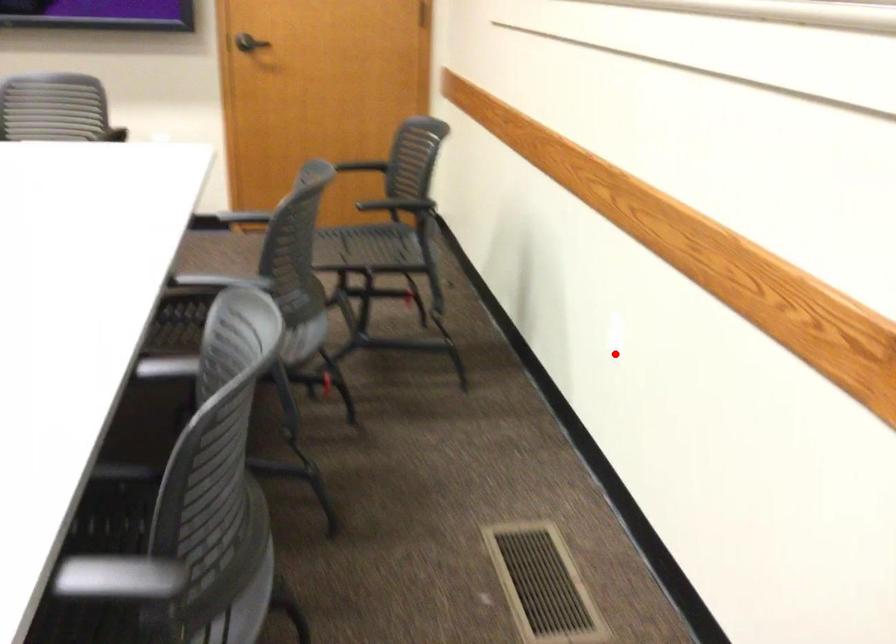
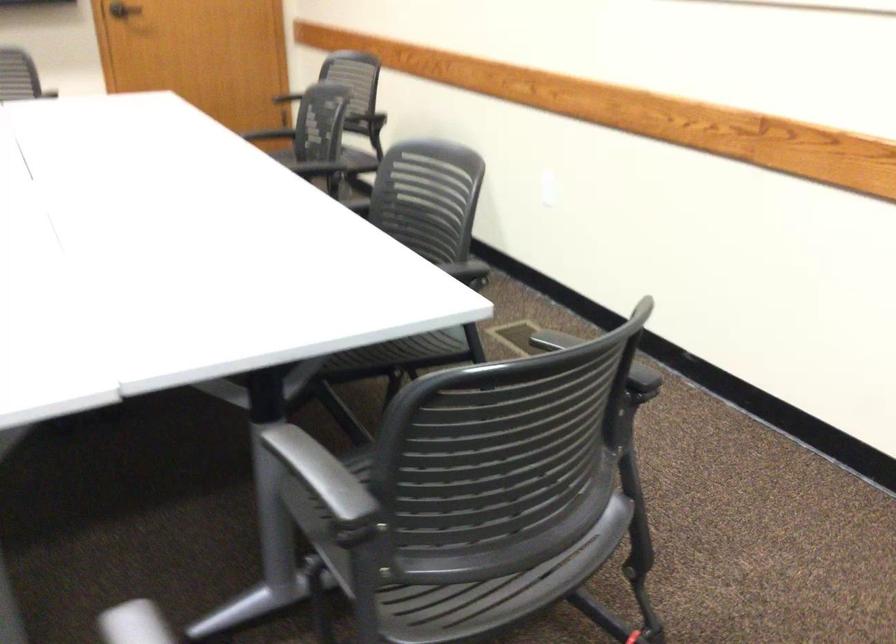
Question: I am providing you with two images of the same scene from different viewpoints. Image1 has a red point marked. In image2, the corresponding 3D location appears at what relative position? Reply with the corresponding letter.

Choices:
 (A) Closer
 (B) Farther

Answer: (B)